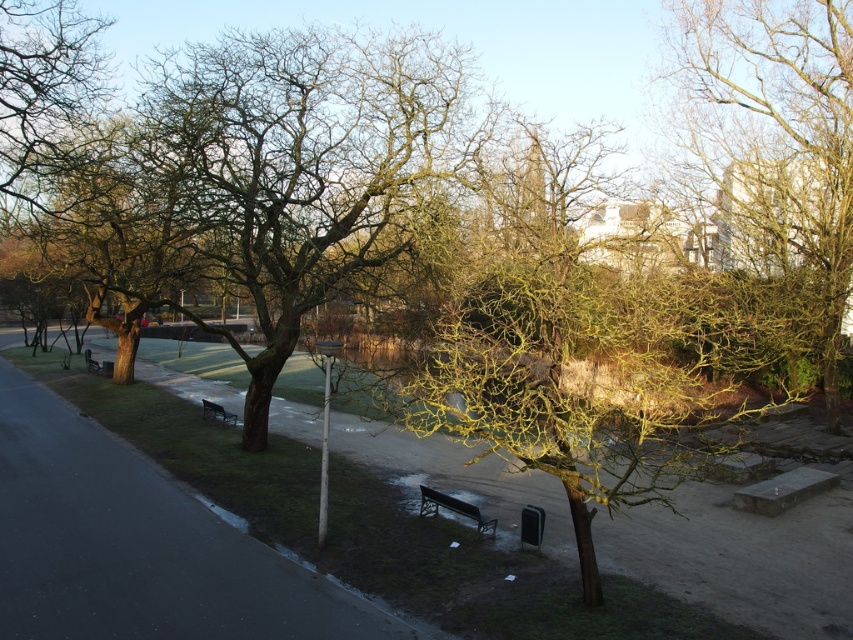
You are planning to take a photo of the green mossy tree at center and the black plastic bench at lower left. Which object should you focus on first if you want to capture both in a single frame without moving the camera?

You should focus on the green mossy tree at center first because it is taller than the black plastic bench at lower left, so it will require more space in the frame to be fully captured.

You are standing at the entrance of the park and see the green mossy tree at center. If you walk straight ahead, will you reach the tree before the path curves to the left?

The green mossy tree at center is located at point (579, 348) in the image, which is along the straight section of the pathway before it curves to the left. Therefore, walking straight ahead will lead you to the tree before encountering the curve.